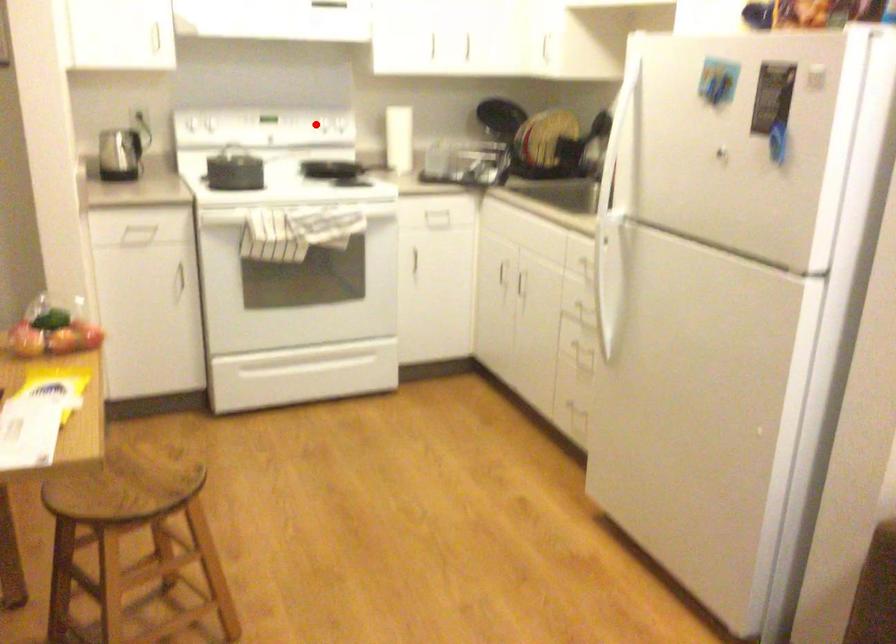
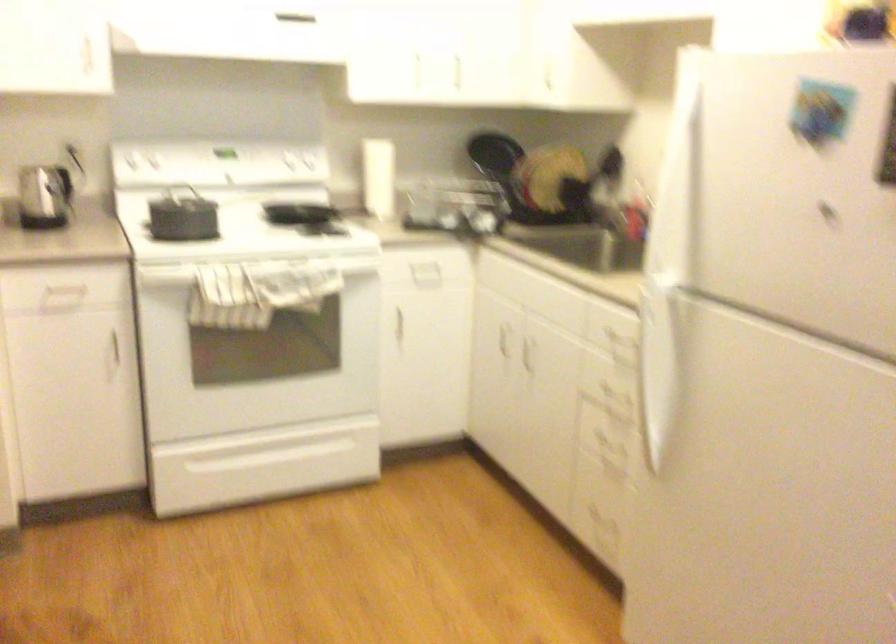
Question: I am providing you with two images of the same scene from different viewpoints. A red point is shown in image1. For the corresponding object point in image2, is it positioned nearer or farther from the camera?

Choices:
 (A) Nearer
 (B) Farther

Answer: (A)